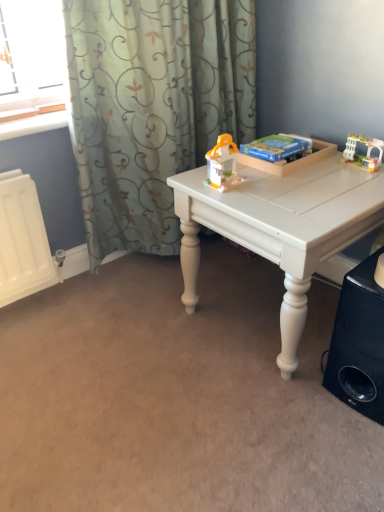
Question: Considering the positions of satin green curtain at upper left and white matte table at center in the image, is satin green curtain at upper left taller or shorter than white matte table at center?

Choices:
 (A) tall
 (B) short

Answer: (A)

Question: In the image, is satin green curtain at upper left positioned in front of or behind white matte table at center?

Choices:
 (A) front
 (B) behind

Answer: (B)

Question: Based on their relative distances, which object is farther from the white matte table at center?

Choices:
 (A) black matte speaker at lower right
 (B) satin green curtain at upper left
 (C) translucent plastic toy at center, which ranks as the second toy in right-to-left order
 (D) white plastic toy at upper right, the first toy when ordered from right to left

Answer: (B)

Question: Estimate the real-world distances between objects in this image. Which object is closer to the satin green curtain at upper left?

Choices:
 (A) white matte table at center
 (B) translucent plastic toy at center, which ranks as the first toy in left-to-right order
 (C) black matte speaker at lower right
 (D) white plastic toy at upper right, marked as the 2th toy in a left-to-right arrangement

Answer: (B)